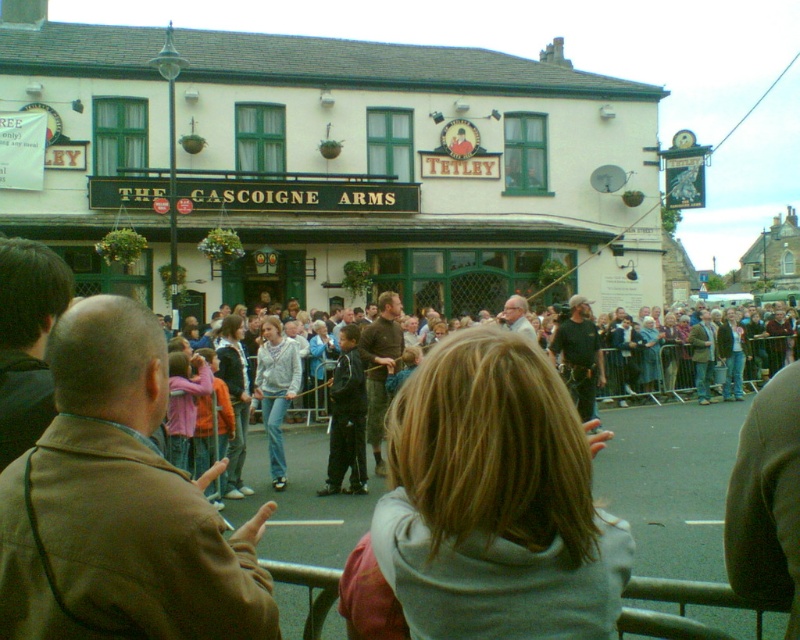
Between light brown hair at center and light gray hoodie at center, which one has less height?

light brown hair at center

Does light brown hair at center have a greater width compared to light gray hoodie at center?

Incorrect, light brown hair at center's width does not surpass light gray hoodie at center's.

Does point (429, 604) come behind point (184, 344)?

No.

Identify the location of light brown hair at center. The width and height of the screenshot is (800, 640). (488, 506).